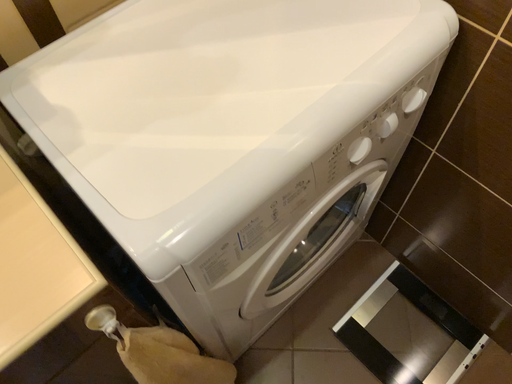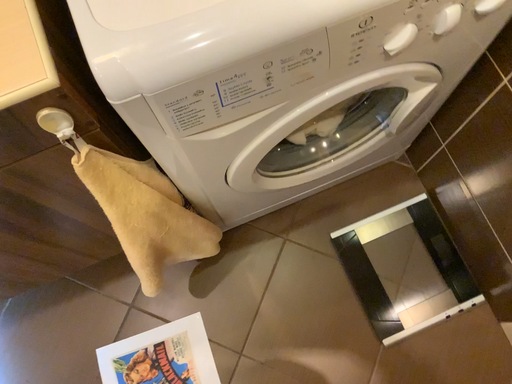
Question: How did the camera likely rotate when shooting the video?

Choices:
 (A) rotated right
 (B) rotated left

Answer: (B)